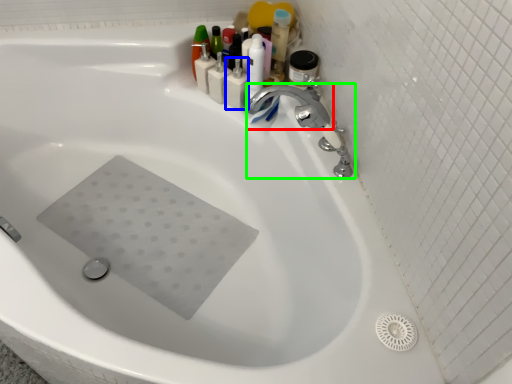
Question: Based on their relative distances, which object is farther from tap (highlighted by a red box)? Choose from toiletry (highlighted by a blue box) and tap (highlighted by a green box).

Choices:
 (A) toiletry
 (B) tap

Answer: (A)